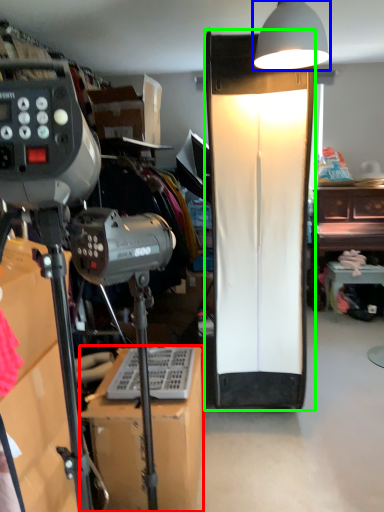
Question: Which object is positioned farthest from furniture (highlighted by a red box)? Select from lamp (highlighted by a blue box) and lamp (highlighted by a green box).

Choices:
 (A) lamp
 (B) lamp

Answer: (A)